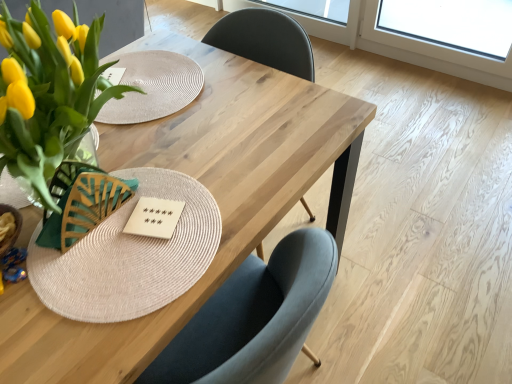
Question: Is transparent glass window screen at upper center positioned with its back to natural wood table at center?

Choices:
 (A) yes
 (B) no

Answer: (B)

Question: From the image's perspective, is transparent glass window screen at upper center on natural wood table at center?

Choices:
 (A) no
 (B) yes

Answer: (B)

Question: Is transparent glass window screen at upper center positioned behind natural wood table at center?

Choices:
 (A) no
 (B) yes

Answer: (B)

Question: Is transparent glass window screen at upper center at the left side of natural wood table at center?

Choices:
 (A) no
 (B) yes

Answer: (A)

Question: From a real-world perspective, is transparent glass window screen at upper center positioned under natural wood table at center based on gravity?

Choices:
 (A) no
 (B) yes

Answer: (B)

Question: Does transparent glass window screen at upper center lie in front of natural wood table at center?

Choices:
 (A) no
 (B) yes

Answer: (A)

Question: Is natural wood table at center not near transparent glass window screen at upper center?

Choices:
 (A) no
 (B) yes

Answer: (B)

Question: From a real-world perspective, is natural wood table at center over transparent glass window screen at upper center?

Choices:
 (A) yes
 (B) no

Answer: (A)

Question: Is natural wood table at center thinner than transparent glass window screen at upper center?

Choices:
 (A) no
 (B) yes

Answer: (A)

Question: Is natural wood table at center further to camera compared to transparent glass window screen at upper center?

Choices:
 (A) yes
 (B) no

Answer: (B)

Question: Can you confirm if natural wood table at center is shorter than transparent glass window screen at upper center?

Choices:
 (A) yes
 (B) no

Answer: (B)

Question: Considering the relative sizes of natural wood table at center and transparent glass window screen at upper center in the image provided, is natural wood table at center taller than transparent glass window screen at upper center?

Choices:
 (A) yes
 (B) no

Answer: (A)

Question: Is wooden card game at center located within natural wood table at center?

Choices:
 (A) no
 (B) yes

Answer: (B)